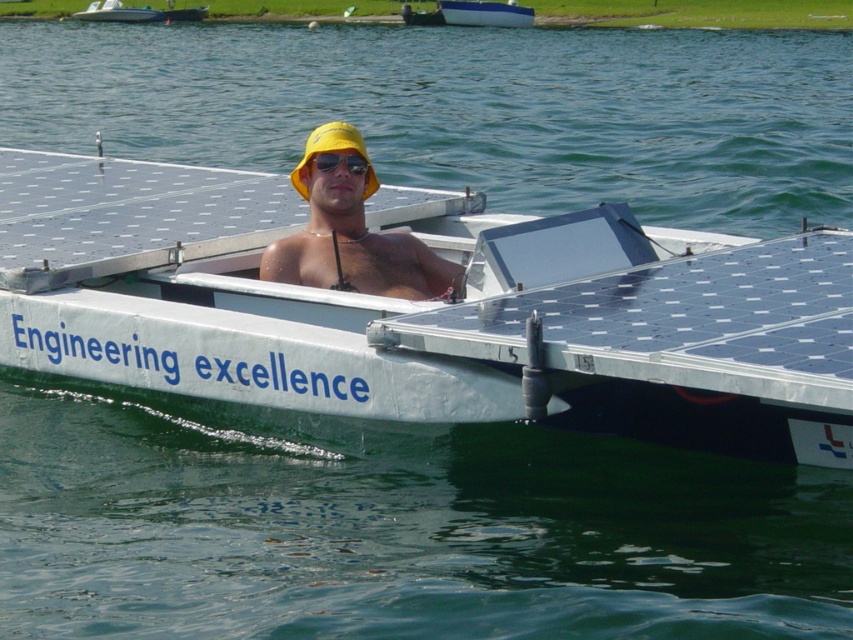
Question: Which of the following is the closest to the observer?

Choices:
 (A) black reflective sunglasses at center
 (B) white metallic boat at center
 (C) blue glossy boat at upper center
 (D) yellow matte hat at center

Answer: (B)

Question: Which object appears farthest from the camera in this image?

Choices:
 (A) black reflective sunglasses at center
 (B) blue glossy boat at upper center

Answer: (B)

Question: Does white metallic boat at center appear under yellow matte hat at center?

Choices:
 (A) yes
 (B) no

Answer: (A)

Question: Is yellow matte hat at center bigger than blue glossy boat at upper center?

Choices:
 (A) no
 (B) yes

Answer: (A)

Question: Can you confirm if white metallic boat at center is wider than black reflective sunglasses at center?

Choices:
 (A) no
 (B) yes

Answer: (B)

Question: Estimate the real-world distances between objects in this image. Which object is closer to the black reflective sunglasses at center?

Choices:
 (A) yellow matte hat at center
 (B) white metallic boat at center

Answer: (A)